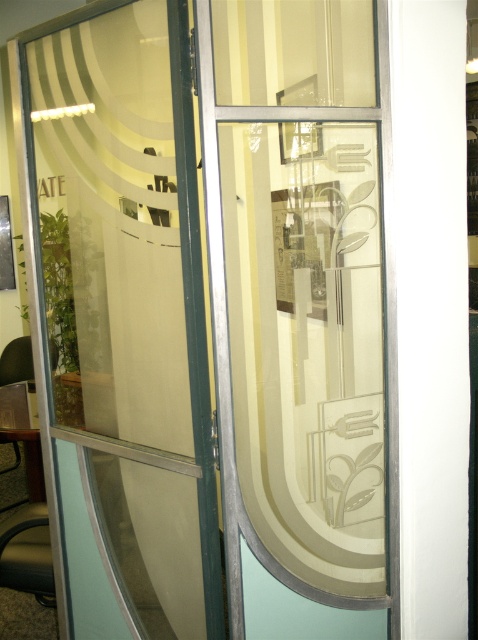
Question: Is etched glass door at center smaller than clear glass door at center?

Choices:
 (A) no
 (B) yes

Answer: (B)

Question: Is etched glass door at center thinner than clear glass door at center?

Choices:
 (A) yes
 (B) no

Answer: (A)

Question: Can you confirm if etched glass door at center is positioned to the left of clear glass door at center?

Choices:
 (A) no
 (B) yes

Answer: (A)